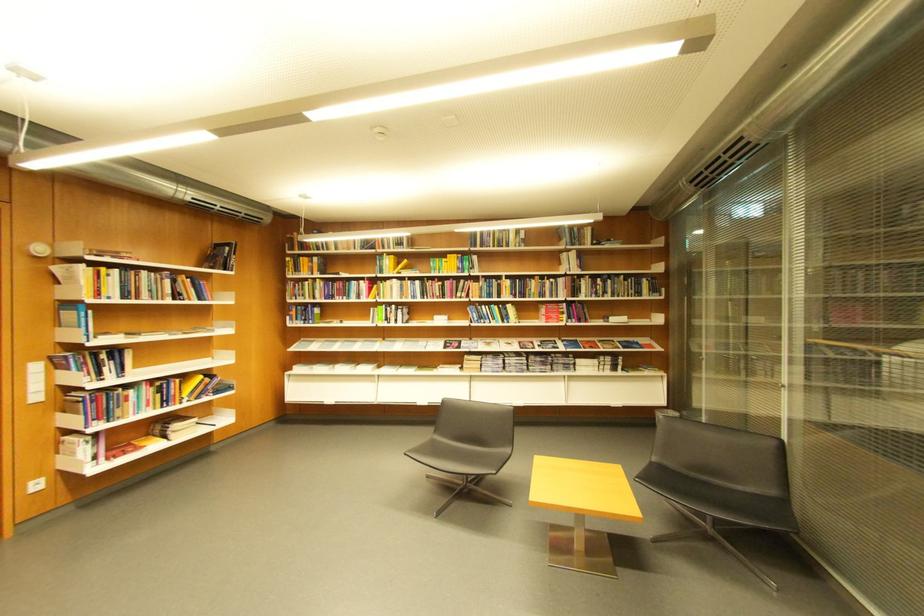
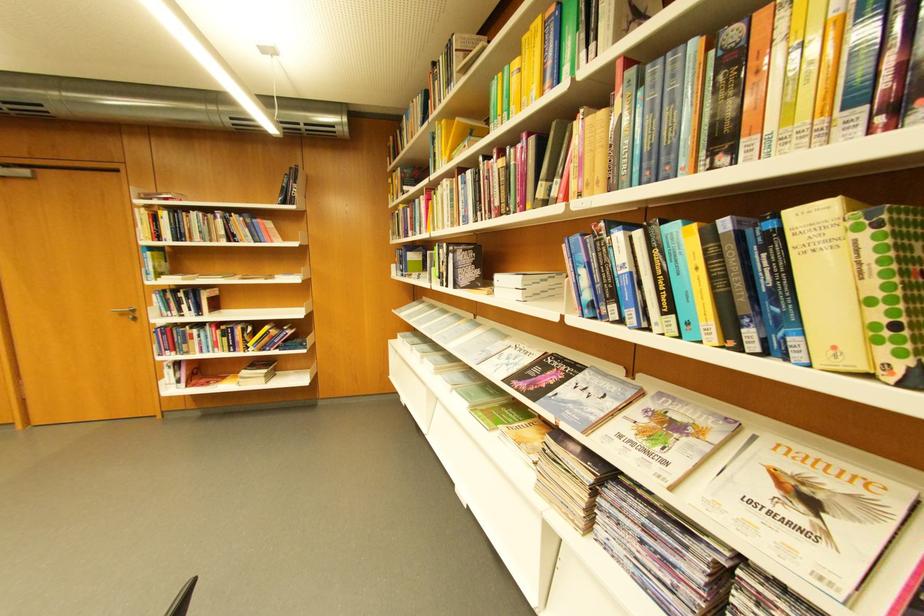
Locate, in the second image, the point that corresponds to (523,307) in the first image.

(861, 209)